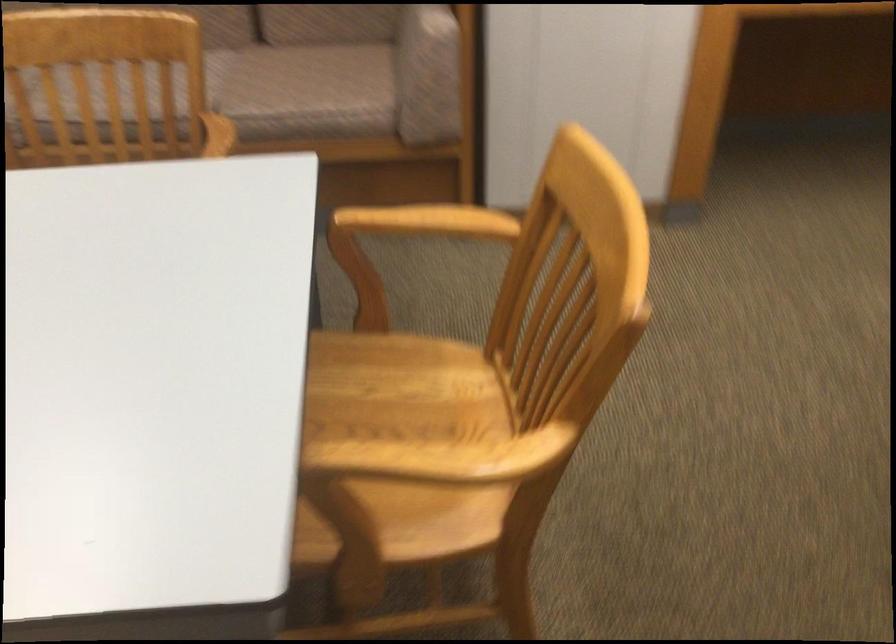
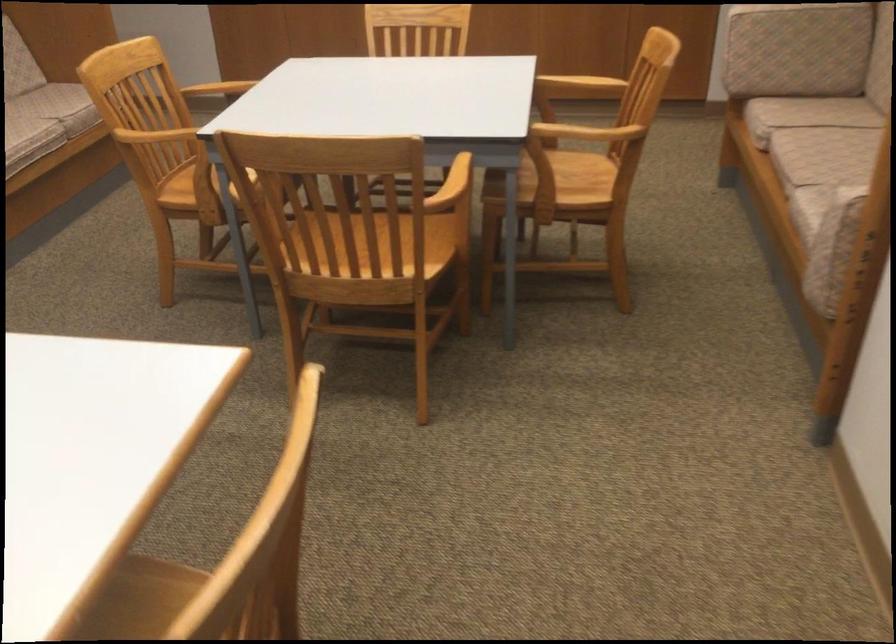
Where in the second image is the point corresponding to (403,214) from the first image?

(470, 174)